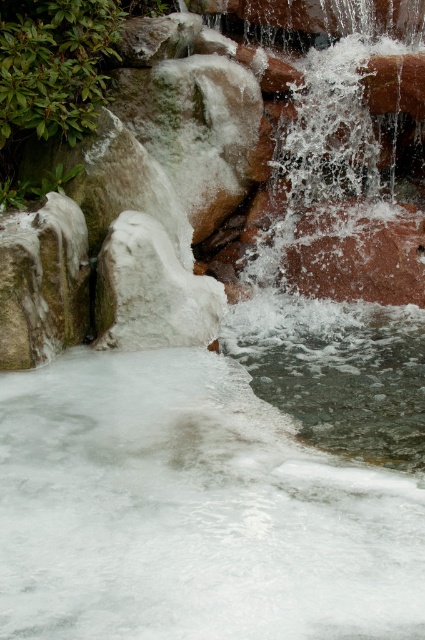
Is white frosty rock at left positioned at the back of white frosty rock at center?

No.

Looking at this image, can you confirm if white frosty rock at left is smaller than white frosty rock at center?

Correct, white frosty rock at left occupies less space than white frosty rock at center.

The image size is (425, 640). What do you see at coordinates (42, 282) in the screenshot?
I see `white frosty rock at left` at bounding box center [42, 282].

At what (x,y) coordinates should I click in order to perform the action: click on white frosty rock at left. Please return your answer as a coordinate pair (x, y). The image size is (425, 640). Looking at the image, I should click on (42, 282).